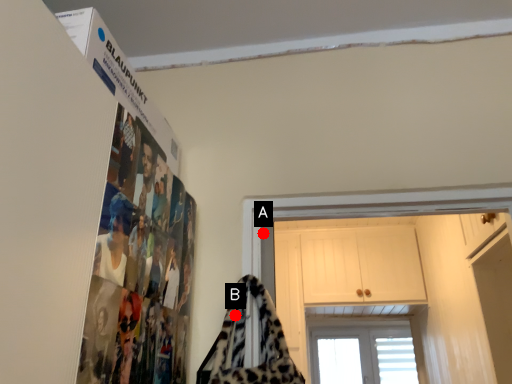
Question: Two points are circled on the image, labeled by A and B beside each circle. Which point is closer to the camera taking this photo?

Choices:
 (A) A is closer
 (B) B is closer

Answer: (B)